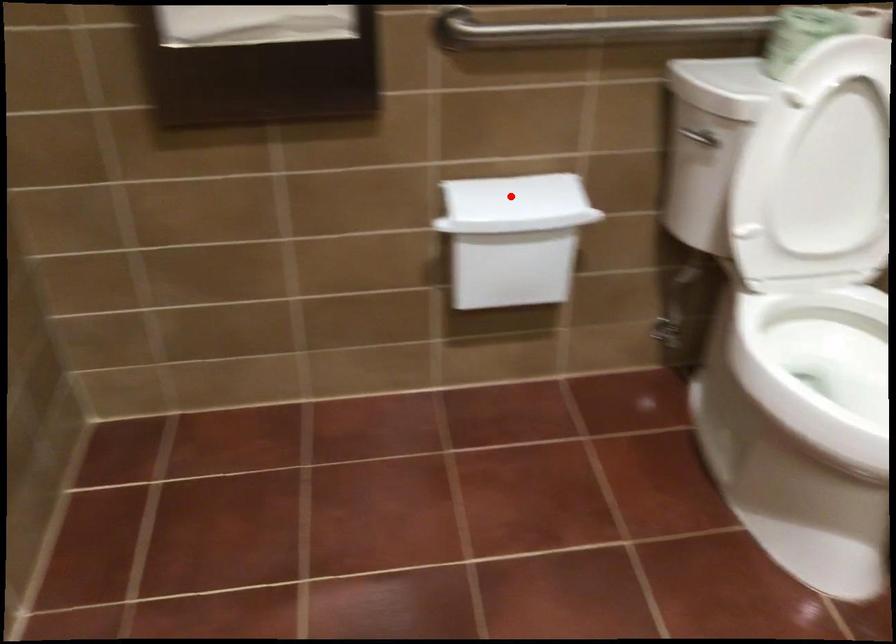
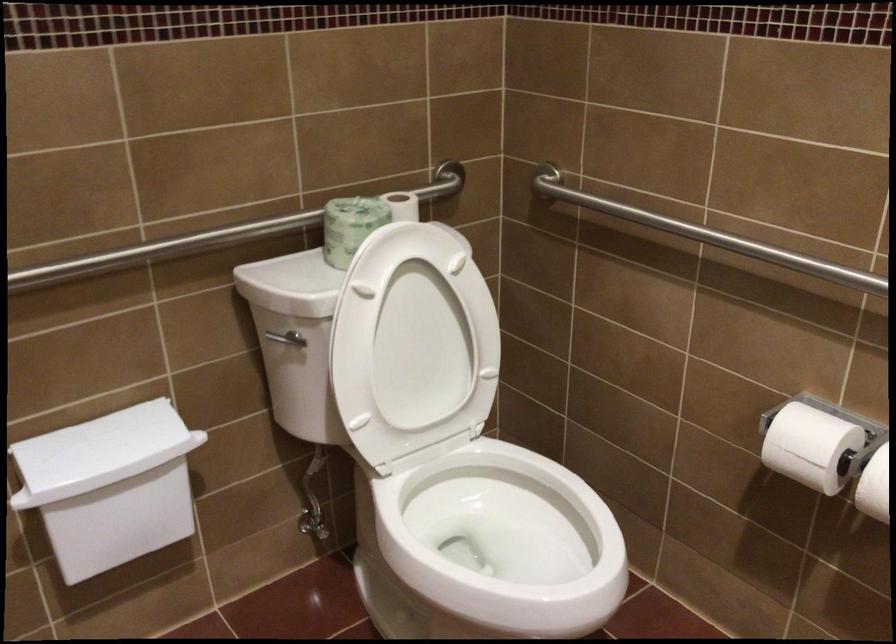
Question: I am providing you with two images of the same scene from different viewpoints. Image1 has a red point marked. In image2, the corresponding 3D location appears at what relative position? Reply with the corresponding letter.

Choices:
 (A) Closer
 (B) Farther

Answer: (A)